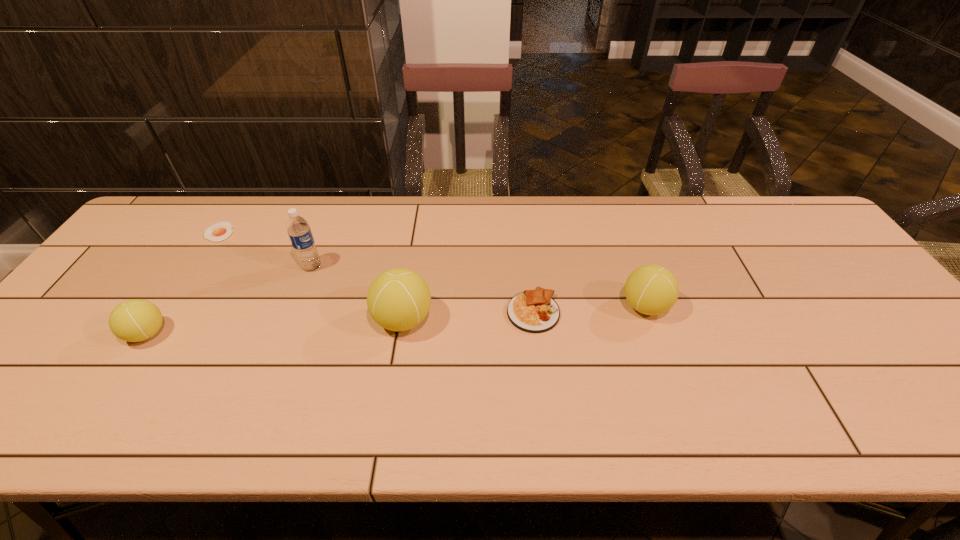
Find the location of a particular element. The image size is (960, 540). the leftmost tennis ball is located at coordinates (135, 320).

In order to click on the fourth tallest object in this screenshot , I will do `click(135, 320)`.

Locate an element on the screen. the fourth object from left to right is located at coordinates pyautogui.click(x=399, y=299).

Locate an element on the screen. This screenshot has width=960, height=540. the tallest tennis ball is located at coordinates (399, 299).

Find the location of a particular element. The width and height of the screenshot is (960, 540). the third tallest object is located at coordinates (651, 289).

Identify the location of the rightmost tennis ball. The height and width of the screenshot is (540, 960). [x=651, y=289].

Where is `the shortest object`? The height and width of the screenshot is (540, 960). the shortest object is located at coordinates point(220,231).

Locate an element on the screen. This screenshot has width=960, height=540. egg yolk is located at coordinates (220, 231).

Where is `the tallest object`? The image size is (960, 540). the tallest object is located at coordinates [298, 229].

Identify the location of the third object from left to right. The image size is (960, 540). (298, 229).